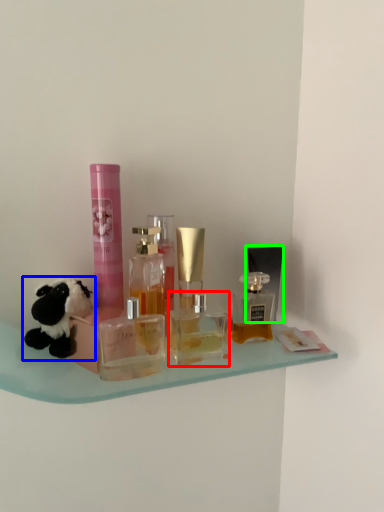
Question: Which is nearer to the bottle (highlighted by a red box)? toy (highlighted by a blue box) or toiletry (highlighted by a green box).

Choices:
 (A) toy
 (B) toiletry

Answer: (B)